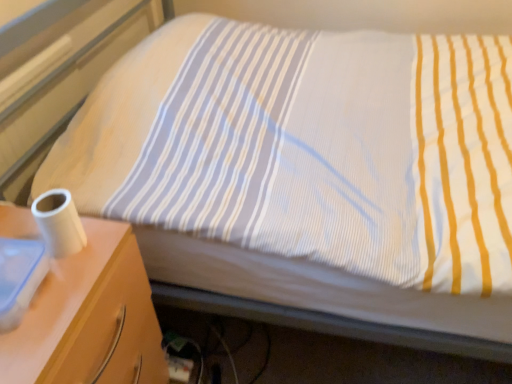
Question: From the image's perspective, is white matte toilet paper at left on top of white glossy nightstand at left?

Choices:
 (A) yes
 (B) no

Answer: (A)

Question: Is white matte toilet paper at left placed right next to white glossy nightstand at left?

Choices:
 (A) yes
 (B) no

Answer: (B)

Question: Can you confirm if white matte toilet paper at left is taller than white glossy nightstand at left?

Choices:
 (A) no
 (B) yes

Answer: (A)

Question: Is white matte toilet paper at left wider than white glossy nightstand at left?

Choices:
 (A) no
 (B) yes

Answer: (A)

Question: Is the position of white matte toilet paper at left more distant than that of white glossy nightstand at left?

Choices:
 (A) yes
 (B) no

Answer: (A)

Question: Considering the relative positions of white matte toilet paper at left and white glossy nightstand at left in the image provided, is white matte toilet paper at left in front of white glossy nightstand at left?

Choices:
 (A) yes
 (B) no

Answer: (B)

Question: Is white glossy nightstand at left facing towards white matte toilet paper at left?

Choices:
 (A) no
 (B) yes

Answer: (A)

Question: From the image's perspective, would you say white glossy nightstand at left is positioned over white matte toilet paper at left?

Choices:
 (A) no
 (B) yes

Answer: (A)

Question: Is white glossy nightstand at left outside white matte toilet paper at left?

Choices:
 (A) no
 (B) yes

Answer: (B)

Question: Can you confirm if white glossy nightstand at left is smaller than white matte toilet paper at left?

Choices:
 (A) no
 (B) yes

Answer: (A)

Question: Can you see white glossy nightstand at left touching white matte toilet paper at left?

Choices:
 (A) no
 (B) yes

Answer: (A)

Question: Is white glossy nightstand at left wider than white matte toilet paper at left?

Choices:
 (A) yes
 (B) no

Answer: (A)

Question: Looking at their shapes, would you say white glossy nightstand at left is wider or thinner than white matte toilet paper at left?

Choices:
 (A) wide
 (B) thin

Answer: (A)